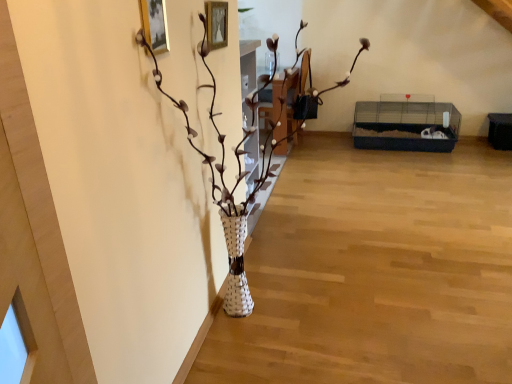
Question: Is there a large distance between white woven vase at center and metallic gold picture frame at upper left?

Choices:
 (A) yes
 (B) no

Answer: (B)

Question: Is white woven vase at center facing towards metallic gold picture frame at upper left?

Choices:
 (A) yes
 (B) no

Answer: (B)

Question: From a real-world perspective, is white woven vase at center on metallic gold picture frame at upper left?

Choices:
 (A) yes
 (B) no

Answer: (B)

Question: Is the position of white woven vase at center more distant than that of metallic gold picture frame at upper left?

Choices:
 (A) no
 (B) yes

Answer: (A)

Question: From the image's perspective, is white woven vase at center located beneath metallic gold picture frame at upper left?

Choices:
 (A) yes
 (B) no

Answer: (A)

Question: Is white woven vase at center at the left side of metallic gold picture frame at upper left?

Choices:
 (A) yes
 (B) no

Answer: (B)

Question: Considering the relative sizes of metallic gold picture frame at upper left and white woven vase at center in the image provided, is metallic gold picture frame at upper left thinner than white woven vase at center?

Choices:
 (A) no
 (B) yes

Answer: (B)

Question: From the image's perspective, is metallic gold picture frame at upper left located above white woven vase at center?

Choices:
 (A) yes
 (B) no

Answer: (A)

Question: Is the depth of metallic gold picture frame at upper left greater than that of white woven vase at center?

Choices:
 (A) no
 (B) yes

Answer: (B)

Question: Is white woven vase at center at the back of metallic gold picture frame at upper left?

Choices:
 (A) yes
 (B) no

Answer: (A)

Question: Considering the relative sizes of metallic gold picture frame at upper left and white woven vase at center in the image provided, is metallic gold picture frame at upper left bigger than white woven vase at center?

Choices:
 (A) no
 (B) yes

Answer: (A)

Question: Is metallic gold picture frame at upper left in contact with white woven vase at center?

Choices:
 (A) no
 (B) yes

Answer: (A)

Question: In terms of height, does white woven vase at center look taller or shorter compared to metallic gold picture frame at upper left?

Choices:
 (A) tall
 (B) short

Answer: (A)